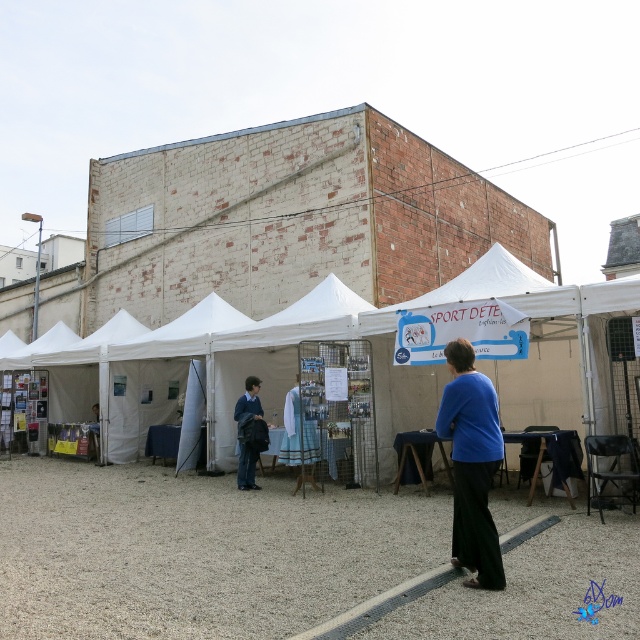
Question: Which point appears farthest from the camera in this image?

Choices:
 (A) (481, 424)
 (B) (65, 467)

Answer: (B)

Question: Is white fabric tent at center closer to camera compared to blue matte shirt at center?

Choices:
 (A) yes
 (B) no

Answer: (A)

Question: Which is farther from the blue sweater at center?

Choices:
 (A) white fabric tent at center
 (B) blue matte shirt at center

Answer: (B)

Question: Which of the following is the farthest from the observer?

Choices:
 (A) blue sweater at center
 (B) white fabric tent at center

Answer: (A)

Question: Is white fabric tent at center wider than blue matte shirt at center?

Choices:
 (A) no
 (B) yes

Answer: (B)

Question: Can you confirm if white fabric tent at center is positioned to the left of blue matte shirt at center?

Choices:
 (A) yes
 (B) no

Answer: (A)